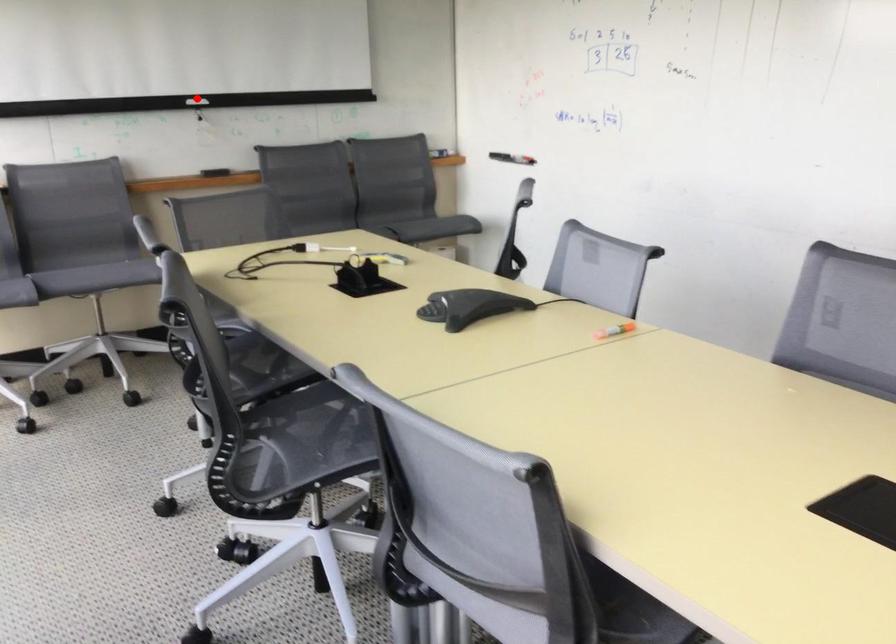
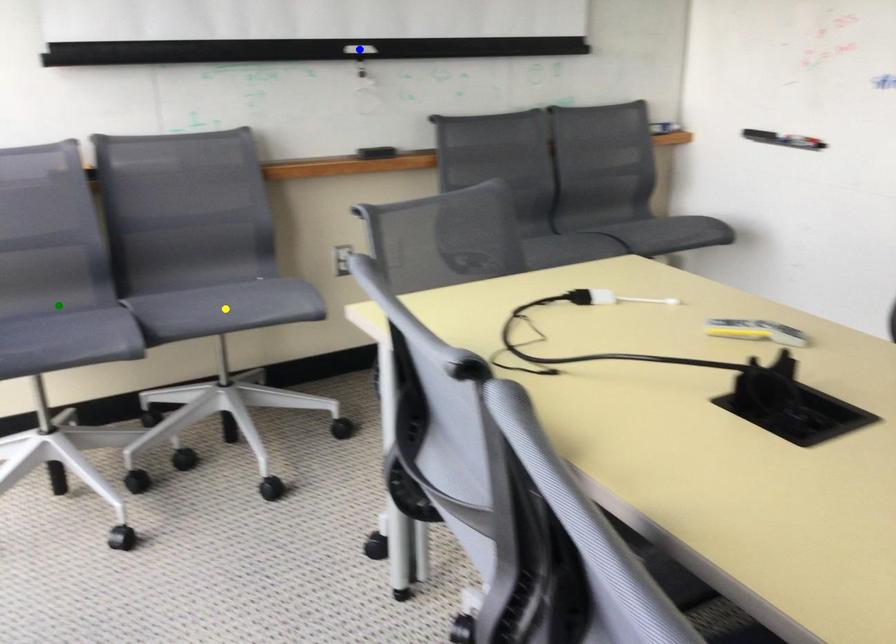
Question: I am providing you with two images of the same scene from different viewpoints. A red point is marked on the first image. You are given multiple points on the second image. Which spot in image 2 lines up with the point in image 1?

Choices:
 (A) green point
 (B) yellow point
 (C) blue point

Answer: (C)